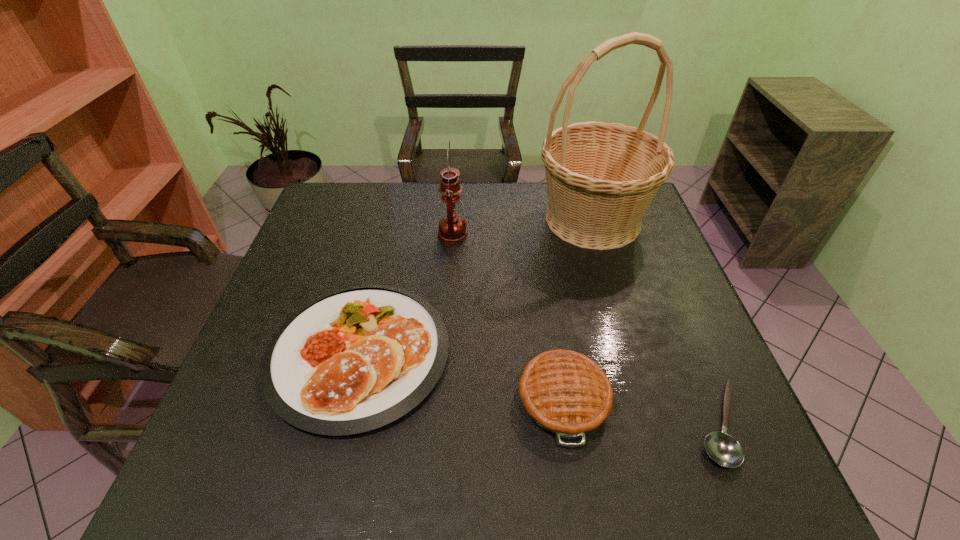
Where is `the tallest object`? This screenshot has height=540, width=960. the tallest object is located at coordinates (601, 177).

The width and height of the screenshot is (960, 540). In order to click on the second tallest object in this screenshot , I will do `click(452, 228)`.

The image size is (960, 540). In order to click on the third shortest object in this screenshot , I will do `click(564, 392)`.

Identify the location of the second shortest object. (356, 359).

The height and width of the screenshot is (540, 960). What are the coordinates of `the shortest object` in the screenshot? It's located at (722, 448).

You are a GUI agent. You are given a task and a screenshot of the screen. Output one action in this format:
    pyautogui.click(x=<x>, y=<y>)
    Task: Click on the free location located on the front of the tallest object
    This screenshot has height=540, width=960.
    Given the screenshot: What is the action you would take?
    pyautogui.click(x=636, y=362)

The height and width of the screenshot is (540, 960). Identify the location of blank space located 0.330m on the right of the oil lamp. (579, 235).

This screenshot has width=960, height=540. What are the coordinates of `blank space located 0.300m on the left of the pie` in the screenshot? It's located at (374, 399).

This screenshot has height=540, width=960. I want to click on vacant space located on the right of the second shortest object, so click(x=567, y=353).

Find the location of a particular element. Image resolution: width=960 pixels, height=540 pixels. vacant region located on the back of the ladle is located at coordinates (693, 362).